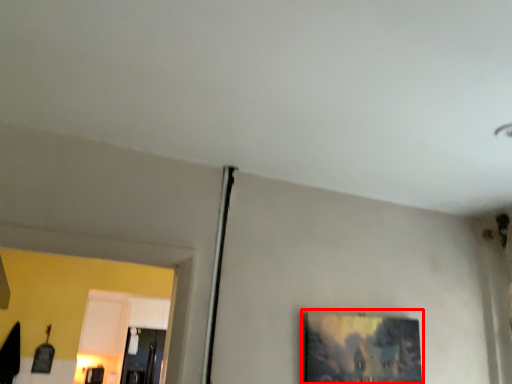
Question: From the image's perspective, where is picture frame (annotated by the red box) located relative to glass door?

Choices:
 (A) above
 (B) below

Answer: (A)